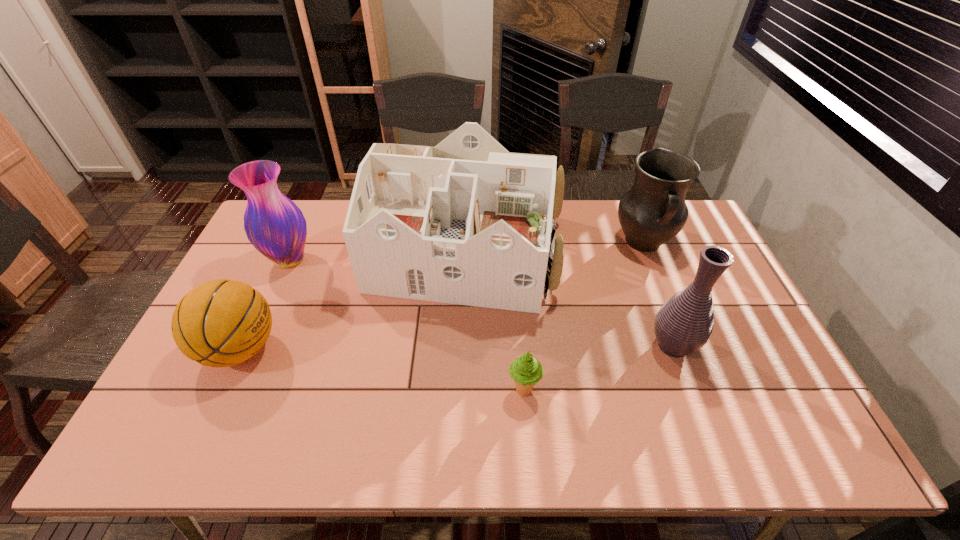
Find the location of a particular element. vacant area at the left edge is located at coordinates (252, 255).

At what (x,y) coordinates should I click in order to perform the action: click on free space at the right edge. Please return your answer as a coordinate pair (x, y). Looking at the image, I should click on (687, 274).

Identify the location of vacant space that's between the pitcher and the shortest object. Image resolution: width=960 pixels, height=540 pixels. (584, 317).

The height and width of the screenshot is (540, 960). I want to click on vacant area that lies between the icecream and the pitcher, so click(584, 317).

Where is `free space between the icecream and the pitcher`? free space between the icecream and the pitcher is located at coordinates (584, 317).

The height and width of the screenshot is (540, 960). I want to click on vacant space in between the dollhouse and the right vase, so click(570, 298).

Locate an element on the screen. This screenshot has height=540, width=960. free area in between the pitcher and the nearer vase is located at coordinates (658, 294).

Where is `empty location between the right vase and the dollhouse`? This screenshot has width=960, height=540. empty location between the right vase and the dollhouse is located at coordinates (570, 298).

Locate which object is the closest to the shortest object. Please provide its 2D coordinates. Your answer should be formatted as a tuple, i.e. [(x, y)], where the tuple contains the x and y coordinates of a point satisfying the conditions above.

[(466, 222)]

Identify the location of object identified as the fifth closest to the farther vase. (683, 325).